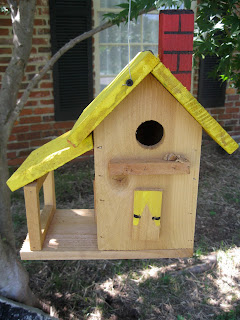
Where is `red painted wood`? This screenshot has width=240, height=320. red painted wood is located at coordinates (172, 40).